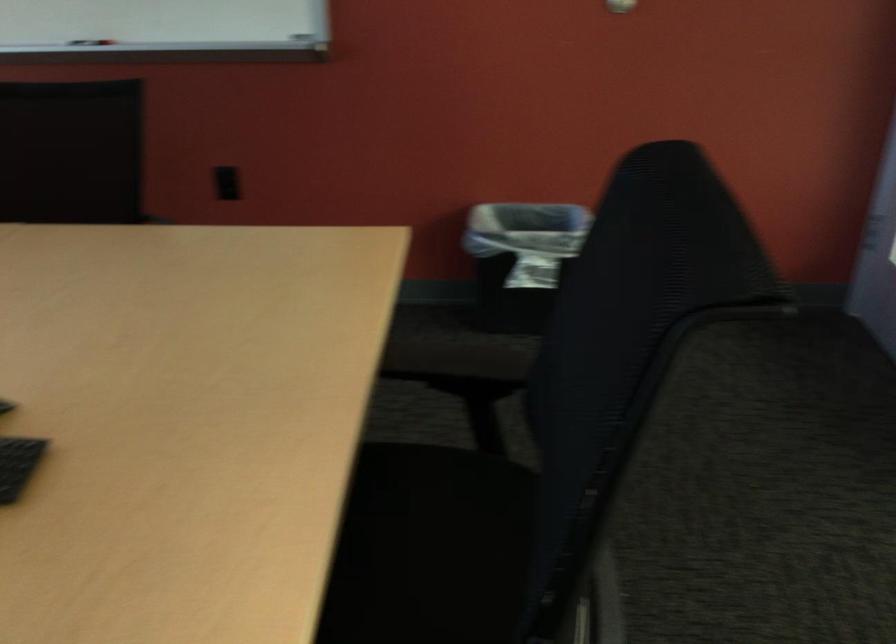
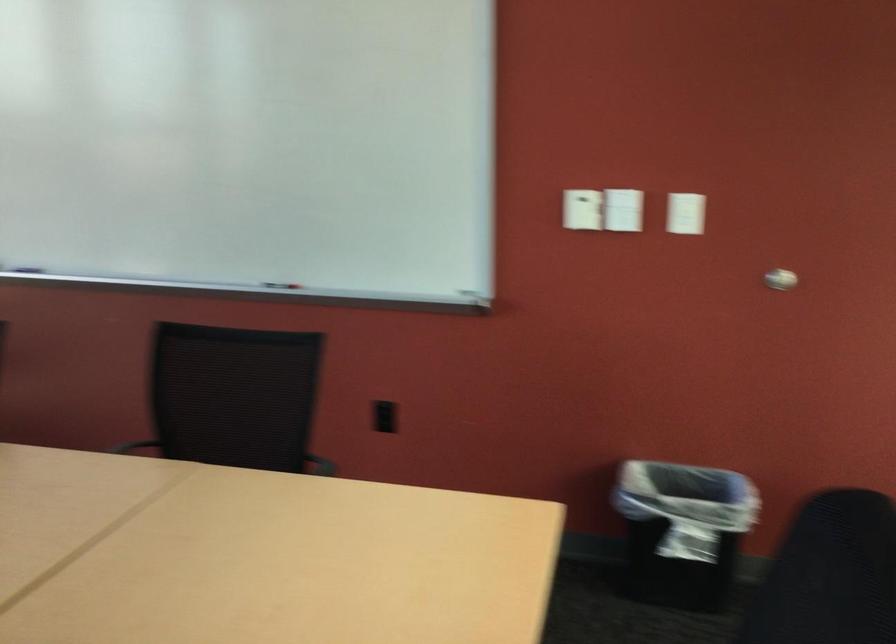
Question: Which direction would the cameraman need to move to produce the second image? Reply with the corresponding letter.

Choices:
 (A) Left
 (B) Right
 (C) Forward
 (D) Backward

Answer: (B)